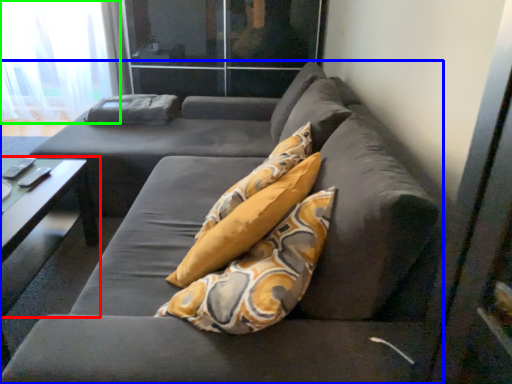
Question: Which object is positioned farthest from table (highlighted by a red box)? Select from studio couch (highlighted by a blue box) and curtain (highlighted by a green box).

Choices:
 (A) studio couch
 (B) curtain

Answer: (B)